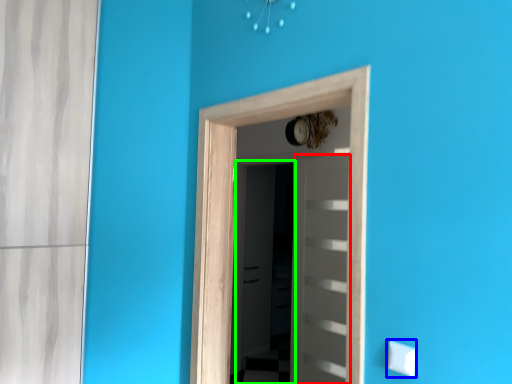
Question: Considering the real-world distances, which object is farthest from door (highlighted by a red box)? light switch (highlighted by a blue box) or screen door (highlighted by a green box)?

Choices:
 (A) light switch
 (B) screen door

Answer: (A)